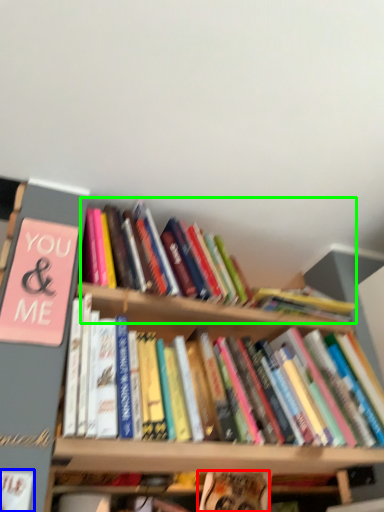
Question: Which object is positioned closest to book (highlighted by a red box)? Select from book (highlighted by a blue box) and book (highlighted by a green box).

Choices:
 (A) book
 (B) book

Answer: (B)